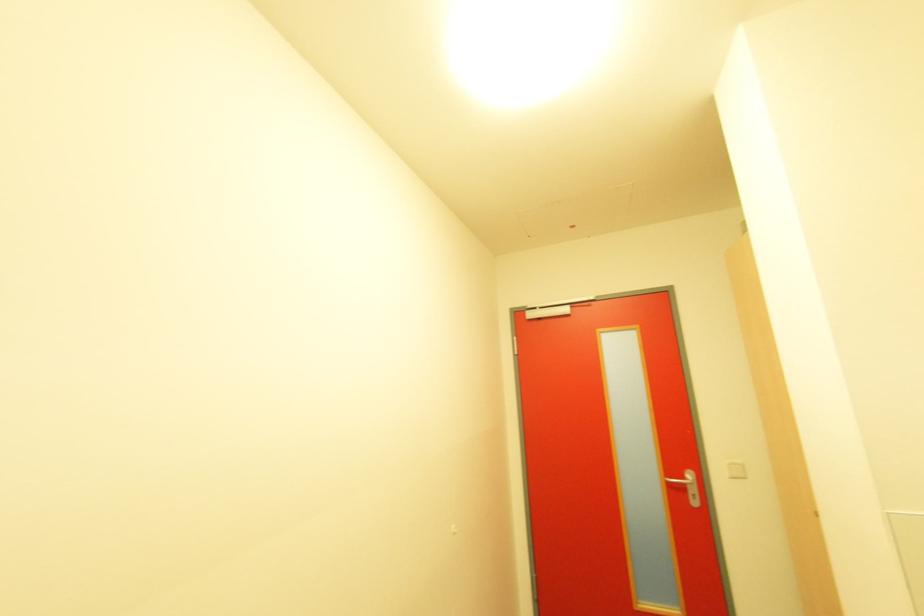
The image size is (924, 616). Identify the location of silver door handle. (684, 479).